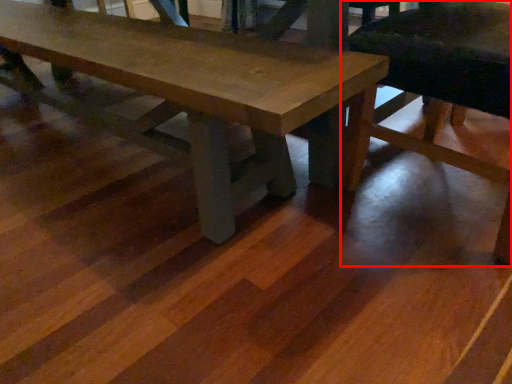
Question: From the image's perspective, where is chair (annotated by the red box) located in relation to table in the image?

Choices:
 (A) above
 (B) below

Answer: (B)